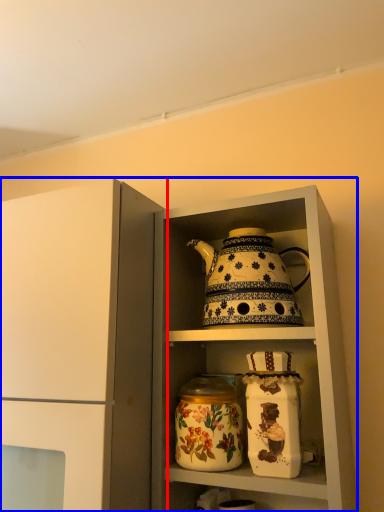
Question: Among these objects, which one is nearest to the camera, cupboard (highlighted by a red box) or cabinetry (highlighted by a blue box)?

Choices:
 (A) cupboard
 (B) cabinetry

Answer: (A)